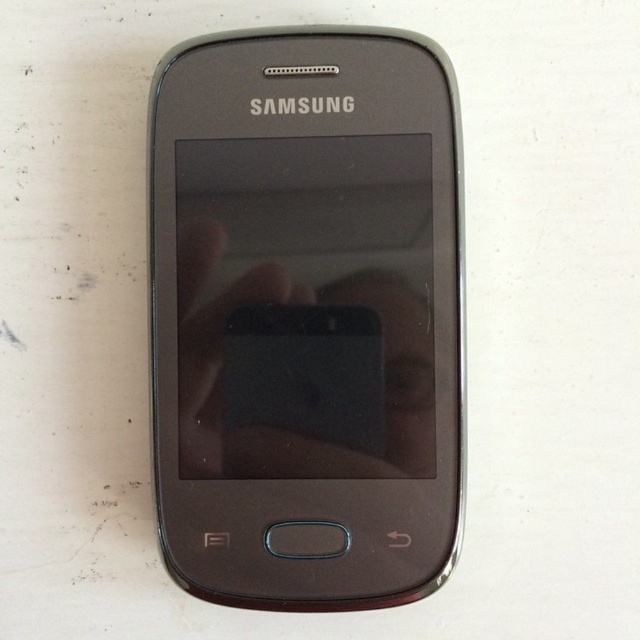
Question: Which of the following is the farthest from the observer?

Choices:
 (A) matte black smartphone at center
 (B) transparent matte hand at center

Answer: (B)

Question: Can you confirm if matte black smartphone at center is wider than transparent matte hand at center?

Choices:
 (A) no
 (B) yes

Answer: (B)

Question: Is matte black smartphone at center further to camera compared to transparent matte hand at center?

Choices:
 (A) yes
 (B) no

Answer: (B)

Question: Does matte black smartphone at center come behind transparent matte hand at center?

Choices:
 (A) no
 (B) yes

Answer: (A)

Question: Among these objects, which one is farthest from the camera?

Choices:
 (A) transparent matte hand at center
 (B) matte black smartphone at center

Answer: (A)